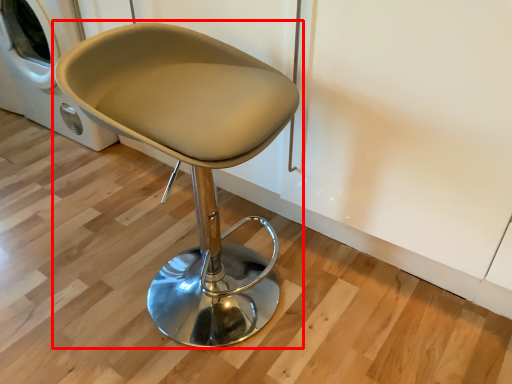
Question: In this image, where is chair (annotated by the red box) located relative to washing machine?

Choices:
 (A) right
 (B) left

Answer: (A)